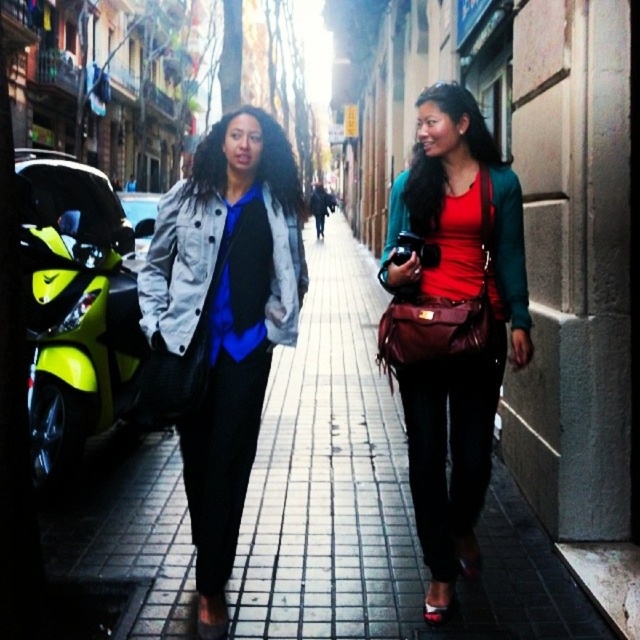
Question: Among these objects, which one is nearest to the camera?

Choices:
 (A) matte red leather bag at center
 (B) brick pavement at center
 (C) matte black jacket at center

Answer: (A)

Question: Does neon yellow plastic motorcycle at left have a lesser width compared to matte blue shirt at center?

Choices:
 (A) no
 (B) yes

Answer: (B)

Question: Does matte black jacket at center have a lesser width compared to matte red leather bag at center?

Choices:
 (A) yes
 (B) no

Answer: (B)

Question: Does neon yellow plastic motorcycle at left appear on the left side of matte blue shirt at center?

Choices:
 (A) no
 (B) yes

Answer: (B)

Question: Based on their relative distances, which object is farther from the matte black jacket at center?

Choices:
 (A) brick pavement at center
 (B) matte red leather bag at center
 (C) neon yellow plastic motorcycle at left

Answer: (A)

Question: Which object is positioned farthest from the matte black jacket at center?

Choices:
 (A) matte blue shirt at center
 (B) brick pavement at center
 (C) neon yellow plastic motorcycle at left

Answer: (B)